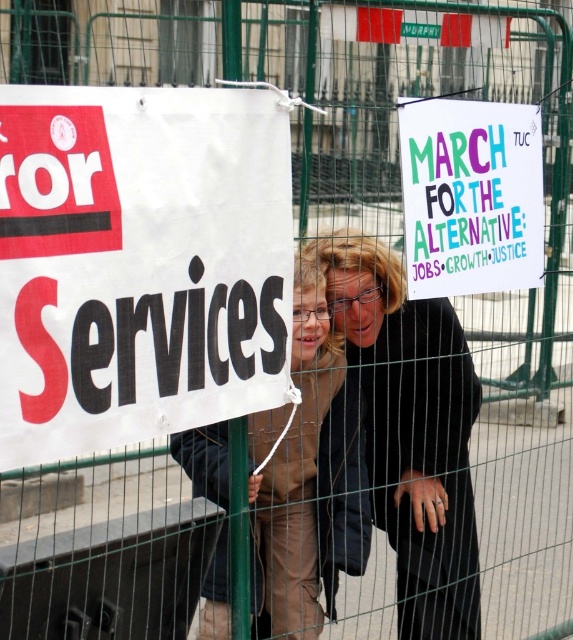
Who is positioned more to the right, black fabric coat at center or brown fabric coat at center?

black fabric coat at center is more to the right.

Does black fabric coat at center have a larger size compared to brown fabric coat at center?

Correct, black fabric coat at center is larger in size than brown fabric coat at center.

Is point (388, 296) positioned behind point (305, 404)?

That is True.

Where is `black fabric coat at center`? black fabric coat at center is located at coordinates (411, 429).

Does white paper sign at left have a lesser height compared to multicolored paper sign at upper right?

No, white paper sign at left is not shorter than multicolored paper sign at upper right.

Locate an element on the screen. The image size is (573, 640). white paper sign at left is located at coordinates 139,262.

Locate an element on the screen. This screenshot has width=573, height=640. white paper sign at left is located at coordinates (139, 262).

Does point (223, 378) lie in front of point (456, 420)?

Yes, point (223, 378) is in front of point (456, 420).

Where is `white paper sign at left`? Image resolution: width=573 pixels, height=640 pixels. white paper sign at left is located at coordinates point(139,262).